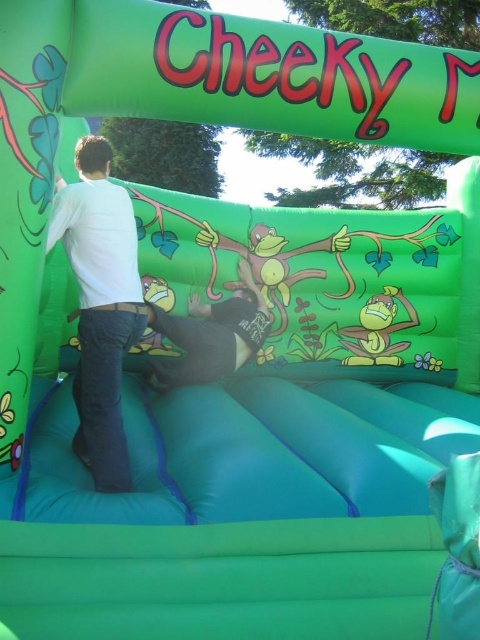
In the scene shown: Which is below, white matte shirt at left or soft black shirt at center?

Positioned lower is soft black shirt at center.

Between white matte shirt at left and soft black shirt at center, which one has less height?

With less height is soft black shirt at center.

Is point (92, 346) closer to viewer compared to point (156, 324)?

Yes.

Identify the location of white matte shirt at left. Image resolution: width=480 pixels, height=640 pixels. (99, 305).

Is white matte shirt at left above green rubber monkey at center?

Yes, white matte shirt at left is above green rubber monkey at center.

Between point (60, 224) and point (407, 324), which one is positioned in front?

Point (60, 224)

Where is `white matte shirt at left`? This screenshot has height=640, width=480. white matte shirt at left is located at coordinates (99, 305).

Is soft black shirt at center closer to camera compared to green rubber monkey at center?

Yes, soft black shirt at center is in front of green rubber monkey at center.

Which is in front, point (181, 339) or point (350, 346)?

Point (181, 339)

Is point (222, 314) more distant than point (372, 330)?

No, it is not.

I want to click on soft black shirt at center, so click(211, 336).